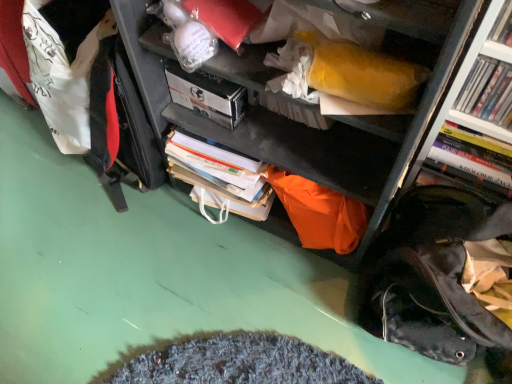
At what (x,y) coordinates should I click in order to perform the action: click on white matte paperback book at upper center. Please return your answer as a coordinate pair (x, y). The height and width of the screenshot is (384, 512). Looking at the image, I should click on (207, 95).

The width and height of the screenshot is (512, 384). Describe the element at coordinates (467, 158) in the screenshot. I see `hardcover book at right, acting as the 1th book starting from the back` at that location.

This screenshot has height=384, width=512. Find the location of `white glossy book at upper right, placed as the 2th book when sorted from front to back`. white glossy book at upper right, placed as the 2th book when sorted from front to back is located at coordinates (488, 92).

Between hardcover book at right, acting as the 1th book starting from the back, and white matte paperback book at upper center, which one has larger width?

white matte paperback book at upper center.

Can you confirm if hardcover book at right, the third book positioned from the front, is positioned to the left of white matte paperback book at upper center?

No.

Is hardcover book at right, acting as the 1th book starting from the back, facing away from white matte paperback book at upper center?

No, hardcover book at right, acting as the 1th book starting from the back, is not facing away from white matte paperback book at upper center.

From the image's perspective, which is below, hardcover book at right, the third book positioned from the front, or white glossy book at upper right, which appears as the 2th book when viewed from the back?

hardcover book at right, the third book positioned from the front, is shown below in the image.

At what (x,y) coordinates should I click in order to perform the action: click on book behind the white glossy book at upper right, placed as the 2th book when sorted from front to back. Please return your answer as a coordinate pair (x, y). Image resolution: width=512 pixels, height=384 pixels. Looking at the image, I should click on (467, 158).

Considering the relative sizes of hardcover book at right, the third book positioned from the front, and white glossy book at upper right, which appears as the 2th book when viewed from the back, in the image provided, is hardcover book at right, the third book positioned from the front, taller than white glossy book at upper right, which appears as the 2th book when viewed from the back,?

No.

What's the angular difference between hardcover book at right, acting as the 1th book starting from the back, and white glossy book at upper right, which appears as the 2th book when viewed from the back,'s facing directions?

The angular difference between hardcover book at right, acting as the 1th book starting from the back, and white glossy book at upper right, which appears as the 2th book when viewed from the back, is 0.000173 degrees.

In the scene shown: Is white matte paperback book at upper center with white glossy book at upper right, placed as the 2th book when sorted from front to back?

white matte paperback book at upper center and white glossy book at upper right, placed as the 2th book when sorted from front to back, are clearly separated.

Does point (177, 68) lie in front of point (476, 88)?

No, it is behind (476, 88).

Does white matte paperback book at upper center have a lesser width compared to white glossy book at upper right, which appears as the 2th book when viewed from the back?

Incorrect, the width of white matte paperback book at upper center is not less than that of white glossy book at upper right, which appears as the 2th book when viewed from the back.

From a real-world perspective, which is physically below, white matte paperback book at upper center or white glossy book at upper right, placed as the 2th book when sorted from front to back?

From a 3D spatial view, white matte paperback book at upper center is below.

Based on the photo, considering the relative sizes of hardcover book at upper right, the third book when ordered from back to front, and white glossy book at upper right, placed as the 2th book when sorted from front to back, in the image provided, is hardcover book at upper right, the third book when ordered from back to front, taller than white glossy book at upper right, placed as the 2th book when sorted from front to back,?

Correct, hardcover book at upper right, the third book when ordered from back to front, is much taller as white glossy book at upper right, placed as the 2th book when sorted from front to back.

Which of these two, hardcover book at upper right, the third book when ordered from back to front, or white glossy book at upper right, placed as the 2th book when sorted from front to back, is bigger?

Bigger between the two is white glossy book at upper right, placed as the 2th book when sorted from front to back.

How many degrees apart are the facing directions of hardcover book at upper right, the third book when ordered from back to front, and white glossy book at upper right, which appears as the 2th book when viewed from the back?

hardcover book at upper right, the third book when ordered from back to front, and white glossy book at upper right, which appears as the 2th book when viewed from the back, are facing 0 degrees away from each other.

Measure the distance between hardcover book at upper right, the third book when ordered from back to front, and white glossy book at upper right, which appears as the 2th book when viewed from the back.

4.15 inches.

Can you confirm if white glossy book at upper right, which appears as the 2th book when viewed from the back, is taller than hardcover book at right, acting as the 1th book starting from the back?

Correct, white glossy book at upper right, which appears as the 2th book when viewed from the back, is much taller as hardcover book at right, acting as the 1th book starting from the back.

Is white glossy book at upper right, which appears as the 2th book when viewed from the back, to the left of hardcover book at right, acting as the 1th book starting from the back, from the viewer's perspective?

Incorrect, white glossy book at upper right, which appears as the 2th book when viewed from the back, is not on the left side of hardcover book at right, acting as the 1th book starting from the back.

Between point (506, 64) and point (472, 171), which one is positioned in front?

Point (506, 64)

Measure the distance from hardcover book at right, the third book positioned from the front, to hardcover book at upper right, the third book when ordered from back to front.

10.64 inches.

Is hardcover book at upper right, the third book when ordered from back to front, at the back of hardcover book at right, acting as the 1th book starting from the back?

That's not correct — hardcover book at right, acting as the 1th book starting from the back, is not looking away from hardcover book at upper right, the third book when ordered from back to front.

Is hardcover book at right, the third book positioned from the front, in front of or behind hardcover book at upper right, the third book when ordered from back to front, in the image?

Clearly, hardcover book at right, the third book positioned from the front, is behind hardcover book at upper right, the third book when ordered from back to front.

Image resolution: width=512 pixels, height=384 pixels. In order to click on the 2nd book above when counting from the hardcover book at right, acting as the 1th book starting from the back (from the image's perspective) in this screenshot , I will do `click(502, 24)`.

From the image's perspective, is hardcover book at upper right, positioned as the first book in front-to-back order, over hardcover book at right, the third book positioned from the front?

Yes.

Do you think hardcover book at upper right, positioned as the first book in front-to-back order, is within hardcover book at right, acting as the 1th book starting from the back, or outside of it?

hardcover book at upper right, positioned as the first book in front-to-back order, is outside hardcover book at right, acting as the 1th book starting from the back.

Which is in front, hardcover book at upper right, the third book when ordered from back to front, or hardcover book at right, the third book positioned from the front?

hardcover book at upper right, the third book when ordered from back to front.

The height and width of the screenshot is (384, 512). In order to click on paperback book located on the left of hardcover book at right, the third book positioned from the front in this screenshot , I will do `click(207, 95)`.

From a real-world perspective, starting from the hardcover book at right, the third book positioned from the front, which book is the 1st one vertically above it? Please provide its 2D coordinates.

[(488, 92)]

From the image, which object appears to be farther from hardcover book at right, the third book positioned from the front, white matte paperback book at upper center or hardcover book at upper right, the third book when ordered from back to front?

white matte paperback book at upper center is further to hardcover book at right, the third book positioned from the front.

From the image, which object appears to be farther from white matte paperback book at upper center, hardcover book at upper right, positioned as the first book in front-to-back order, or hardcover book at right, acting as the 1th book starting from the back?

The object further to white matte paperback book at upper center is hardcover book at upper right, positioned as the first book in front-to-back order.

From the image, which object appears to be nearer to hardcover book at right, the third book positioned from the front, white glossy book at upper right, placed as the 2th book when sorted from front to back, or white matte paperback book at upper center?

The object closer to hardcover book at right, the third book positioned from the front, is white glossy book at upper right, placed as the 2th book when sorted from front to back.

When comparing their distances from white glossy book at upper right, which appears as the 2th book when viewed from the back, does hardcover book at upper right, the third book when ordered from back to front, or hardcover book at right, the third book positioned from the front, seem closer?

hardcover book at upper right, the third book when ordered from back to front, is positioned closer to the anchor white glossy book at upper right, which appears as the 2th book when viewed from the back.

Which object lies further to the anchor point white matte paperback book at upper center, hardcover book at upper right, positioned as the first book in front-to-back order, or white glossy book at upper right, which appears as the 2th book when viewed from the back?

Among the two, hardcover book at upper right, positioned as the first book in front-to-back order, is located further to white matte paperback book at upper center.

From the image, which object appears to be nearer to hardcover book at upper right, positioned as the first book in front-to-back order, white matte paperback book at upper center or white glossy book at upper right, which appears as the 2th book when viewed from the back?

white glossy book at upper right, which appears as the 2th book when viewed from the back.

Based on the photo, looking at the image, which one is located further to hardcover book at right, acting as the 1th book starting from the back, hardcover book at upper right, positioned as the first book in front-to-back order, or white glossy book at upper right, which appears as the 2th book when viewed from the back?

Based on the image, hardcover book at upper right, positioned as the first book in front-to-back order, appears to be further to hardcover book at right, acting as the 1th book starting from the back.

Based on their spatial positions, is white glossy book at upper right, placed as the 2th book when sorted from front to back, or hardcover book at upper right, the third book when ordered from back to front, further from white matte paperback book at upper center?

The object further to white matte paperback book at upper center is hardcover book at upper right, the third book when ordered from back to front.

The height and width of the screenshot is (384, 512). Identify the location of book between white matte paperback book at upper center and hardcover book at right, acting as the 1th book starting from the back, from left to right. (502, 24).

Where is `book located between hardcover book at upper right, the third book when ordered from back to front, and hardcover book at right, the third book positioned from the front, in the depth direction`? Image resolution: width=512 pixels, height=384 pixels. book located between hardcover book at upper right, the third book when ordered from back to front, and hardcover book at right, the third book positioned from the front, in the depth direction is located at coordinates (488, 92).